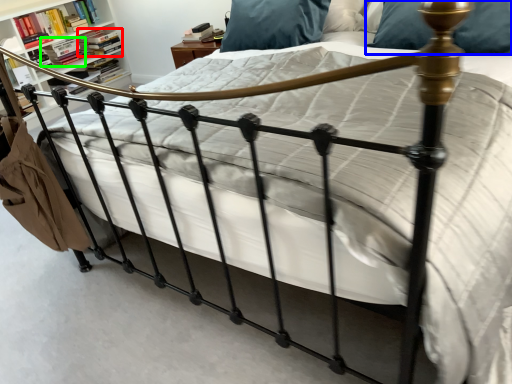
Question: Which object is the farthest from book (highlighted by a red box)? Choose among these: pillow (highlighted by a blue box) or book (highlighted by a green box).

Choices:
 (A) pillow
 (B) book

Answer: (A)